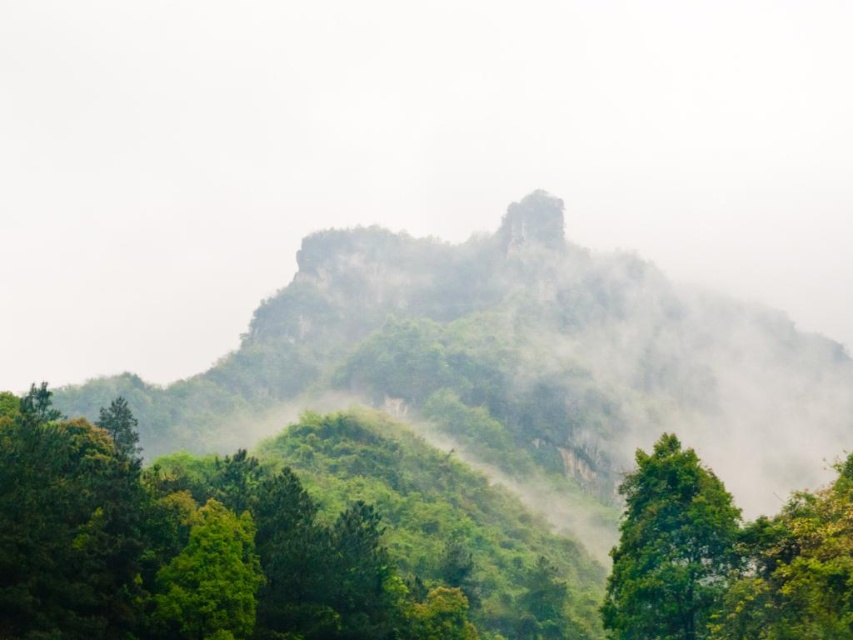
From the picture: Who is higher up, green leafy tree at lower right or green leafy tree at lower left?

Positioned higher is green leafy tree at lower right.

Locate an element on the screen. The height and width of the screenshot is (640, 853). green leafy tree at lower right is located at coordinates (793, 570).

Where is `green leafy tree at lower right`? green leafy tree at lower right is located at coordinates (793, 570).

Between green leafy tree at center and green leafy tree at lower right, which one is positioned higher?

Positioned higher is green leafy tree at lower right.

Can you confirm if green leafy tree at center is bigger than green leafy tree at lower right?

Actually, green leafy tree at center might be smaller than green leafy tree at lower right.

Which is in front, point (647, 540) or point (755, 532)?

Point (755, 532) is more forward.

The width and height of the screenshot is (853, 640). In order to click on green leafy tree at center in this screenshot , I will do `click(669, 547)`.

Does green leafy tree at center have a greater width compared to green leafy tree at lower left?

Yes.

How far apart are green leafy tree at center and green leafy tree at lower left?

green leafy tree at center is 19.33 meters from green leafy tree at lower left.

I want to click on green leafy tree at center, so click(x=669, y=547).

The height and width of the screenshot is (640, 853). I want to click on green leafy tree at center, so click(669, 547).